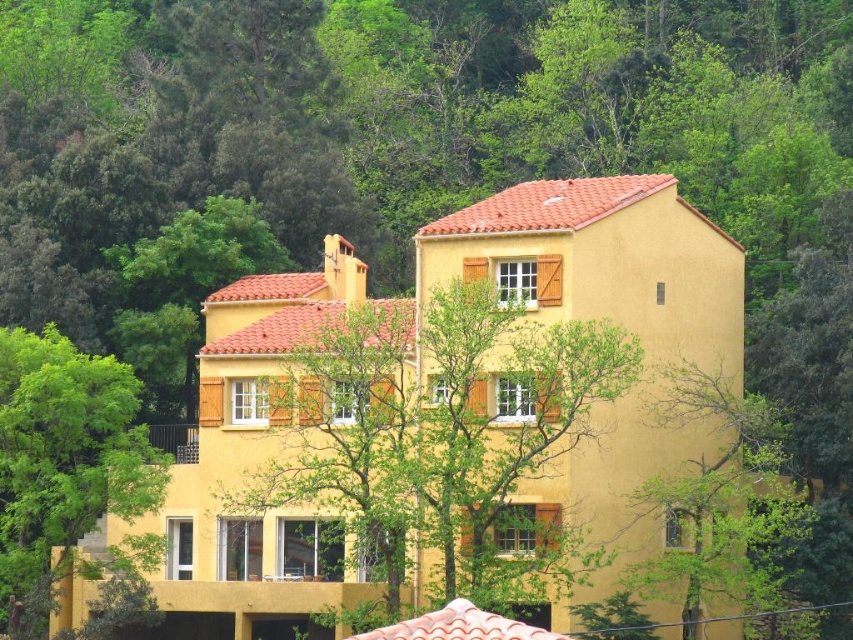
Question: Which of the following is the closest to the observer?

Choices:
 (A) (469, 481)
 (B) (3, 509)

Answer: (A)

Question: Among these points, which one is farthest from the camera?

Choices:
 (A) (38, 564)
 (B) (621, 352)

Answer: (A)

Question: Is green leafy tree at center smaller than green leafy tree at lower left?

Choices:
 (A) yes
 (B) no

Answer: (B)

Question: Does green leafy tree at center appear on the left side of green leafy tree at lower left?

Choices:
 (A) yes
 (B) no

Answer: (B)

Question: Is green leafy tree at center bigger than green leafy tree at lower left?

Choices:
 (A) yes
 (B) no

Answer: (A)